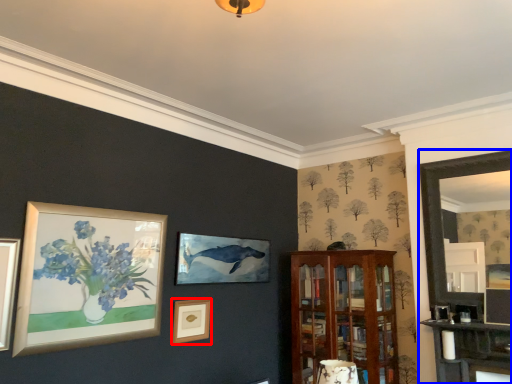
Question: Among these objects, which one is nearest to the camera, picture frame (highlighted by a red box) or fireplace (highlighted by a blue box)?

Choices:
 (A) picture frame
 (B) fireplace

Answer: (B)